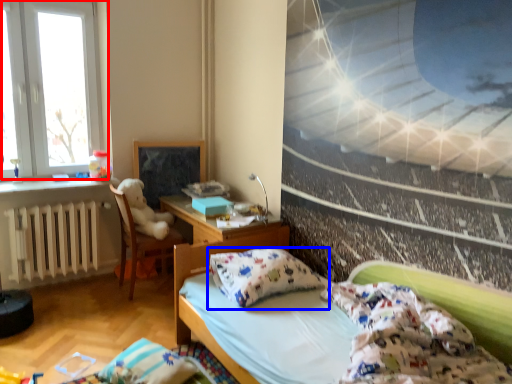
Question: Which object is closer to the camera taking this photo, window (highlighted by a red box) or pillow (highlighted by a blue box)?

Choices:
 (A) window
 (B) pillow

Answer: (B)